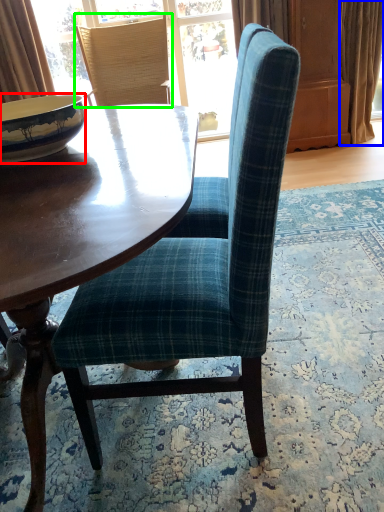
Question: Considering the real-world distances, which object is closest to bowl (highlighted by a red box)? curtain (highlighted by a blue box) or chair (highlighted by a green box).

Choices:
 (A) curtain
 (B) chair

Answer: (B)